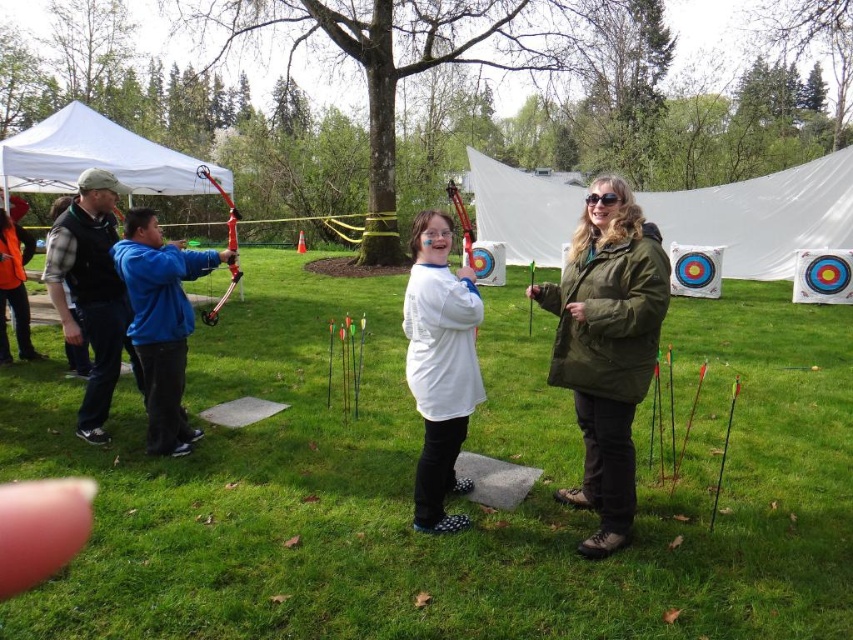
You are an archer preparing to shoot an arrow. You want to ensure your arrow doesn not hit the olive green parka at center or the white fabric tent at upper left. Which object is farther away from you so you can aim accordingly?

The white fabric tent at upper left is farther away from the olive green parka at center than the olive green parka at center, so you should aim away from the white fabric tent at upper left first since it is farther.

You are an archer preparing to shoot an arrow. You notice a white fabric tent at upper center located at point (762,216). Would you need to adjust your aim to avoid hitting the tent?

Yes, you should adjust your aim to avoid hitting the white fabric tent at upper center located at point (762,216) since it is positioned in the upper center area of the target zone.